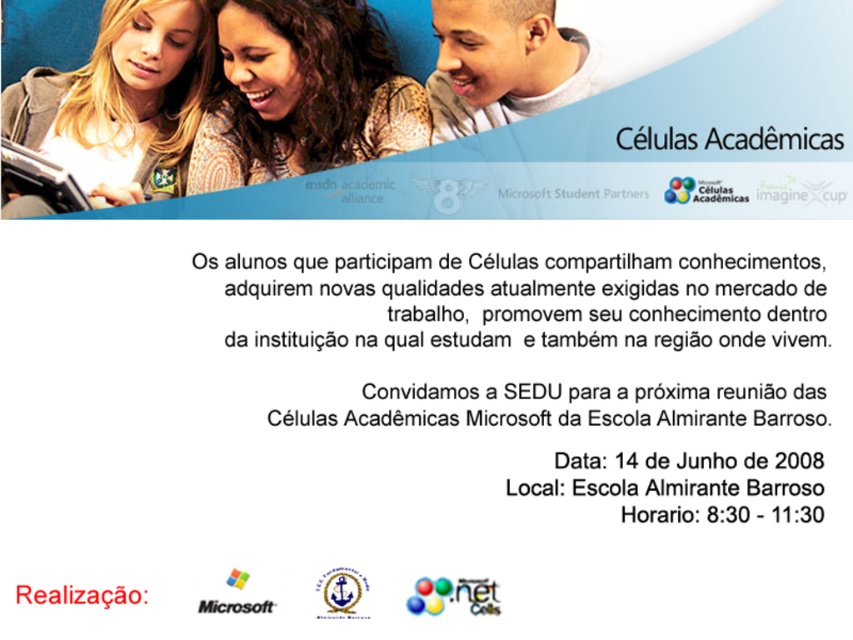
Who is shorter, white paper at center or brown textured sweater at upper center?

With less height is brown textured sweater at upper center.

Between point (653, 292) and point (383, 129), which one is positioned behind?

The point (383, 129) is behind.

Identify the location of white paper at center. Image resolution: width=853 pixels, height=640 pixels. (550, 397).

Who is more forward, (775, 432) or (456, 108)?

Point (775, 432) is in front.

Is white paper at center thinner than matte black laptop at upper center?

In fact, white paper at center might be wider than matte black laptop at upper center.

Is point (376, 420) farther from camera compared to point (573, 84)?

No.

You are a GUI agent. You are given a task and a screenshot of the screen. Output one action in this format:
    pyautogui.click(x=<x>, y=<y>)
    Task: Click on the white paper at center
    The image size is (853, 640).
    Given the screenshot: What is the action you would take?
    pyautogui.click(x=550, y=397)

Measure the distance between black text at upper center and camera.

A distance of 4.43 feet exists between black text at upper center and camera.

Does black text at upper center appear under black matte microsoft logo at upper center?

No, black text at upper center is not below black matte microsoft logo at upper center.

What do you see at coordinates (773, 140) in the screenshot? Image resolution: width=853 pixels, height=640 pixels. I see `black text at upper center` at bounding box center [773, 140].

This screenshot has width=853, height=640. I want to click on black text at upper center, so click(x=773, y=140).